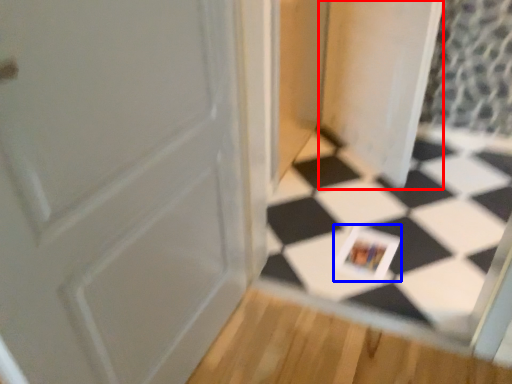
Question: Which object is further to the camera taking this photo, screen door (highlighted by a red box) or postcard (highlighted by a blue box)?

Choices:
 (A) screen door
 (B) postcard

Answer: (B)